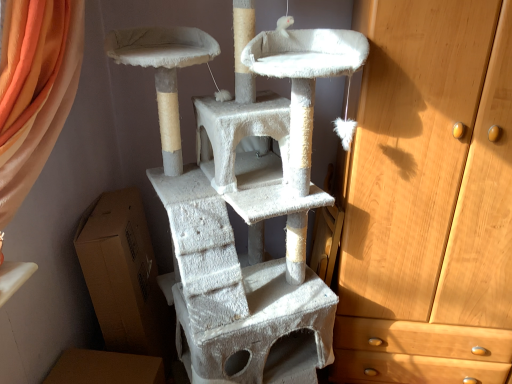
Question: Is point coord(387,230) closer or farther from the camera than point coord(152,286)?

Choices:
 (A) farther
 (B) closer

Answer: (B)

Question: Considering the positions of light brown wooden chest of drawers at right and brown cardboard box at lower left in the image, is light brown wooden chest of drawers at right wider or thinner than brown cardboard box at lower left?

Choices:
 (A) wide
 (B) thin

Answer: (A)

Question: Which object is positioned closest to the brown cardboard box at lower left?

Choices:
 (A) white textured cat tree at center
 (B) light brown wooden chest of drawers at right

Answer: (A)

Question: Considering the real-world distances, which object is closest to the brown cardboard box at lower left?

Choices:
 (A) white textured cat tree at center
 (B) light brown wooden chest of drawers at right

Answer: (A)